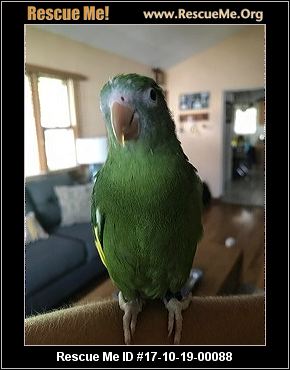
At what (x,y) coordinates should I click in order to perform the action: click on couch pillows. Please return your answer as a coordinate pair (x, y). The width and height of the screenshot is (290, 370). Looking at the image, I should click on [x=76, y=207], [x=30, y=225].